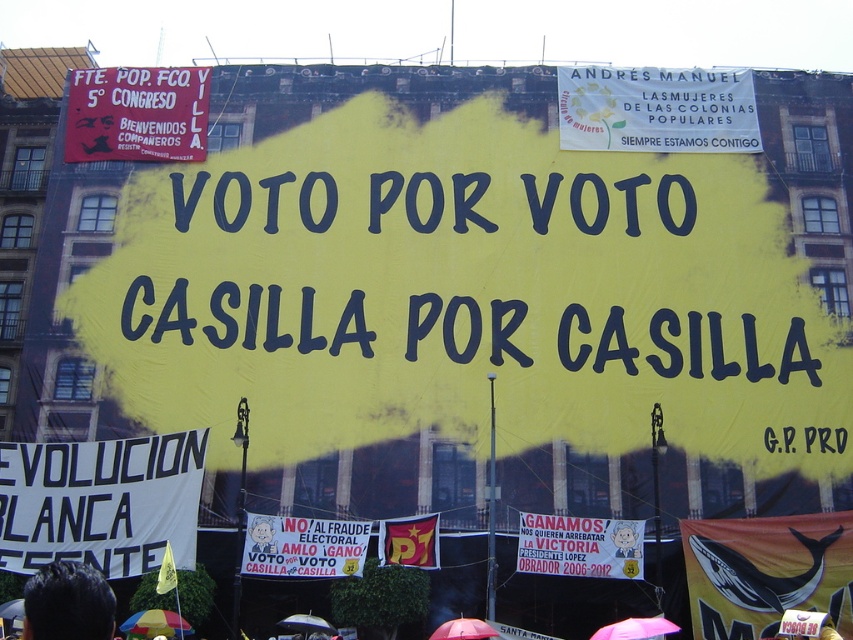
Does white paper banner at center lie in front of black hair at lower left?

No.

Is white paper banner at center shorter than black hair at lower left?

Yes, white paper banner at center is shorter than black hair at lower left.

Who is more distant from viewer, [618,572] or [28,579]?

The point [28,579] is behind.

Find the location of a particular element. The width and height of the screenshot is (853, 640). white paper banner at center is located at coordinates [579, 547].

Is white fabric banner at lower left closer to the viewer compared to white paper banner at center?

No, white fabric banner at lower left is behind white paper banner at center.

Image resolution: width=853 pixels, height=640 pixels. Find the location of `white fabric banner at lower left`. white fabric banner at lower left is located at coordinates (102, 502).

Does yellow paper at center have a greater width compared to white fabric banner at lower left?

Correct, the width of yellow paper at center exceeds that of white fabric banner at lower left.

Does yellow paper at center appear under white fabric banner at lower left?

Incorrect, yellow paper at center is not positioned below white fabric banner at lower left.

Between point (401, 152) and point (88, 531), which one is positioned in front?

Point (88, 531)

The height and width of the screenshot is (640, 853). I want to click on yellow paper at center, so click(465, 296).